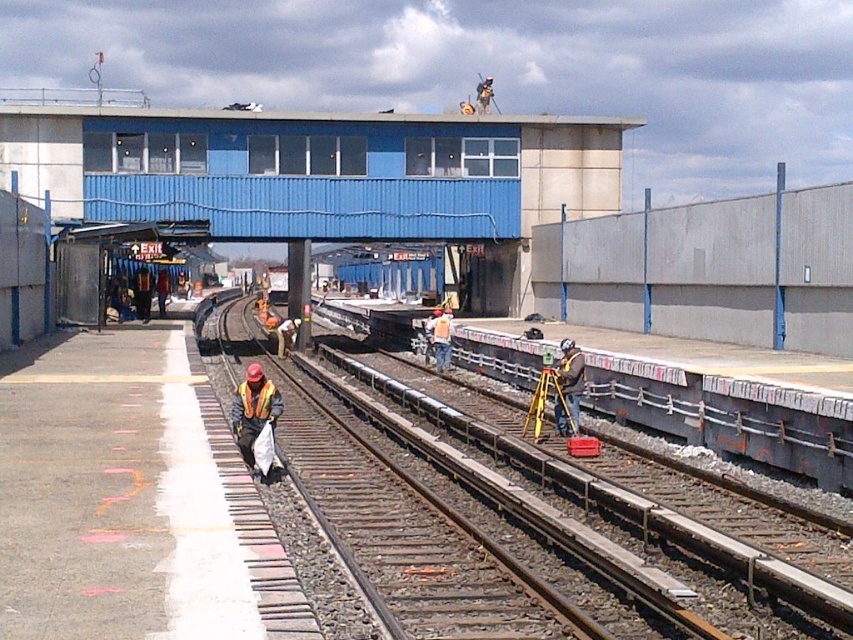
You are standing at the construction site and want to reach the point marked as point (578, 417). The safety regulations state that you must stay at least 60 feet away from any active work zones. Can you safely approach this point without violating the safety rule?

The distance between you and point (578, 417) is 61.67 feet, which is greater than the required 60 feet safety distance. Therefore, you can safely approach this point without violating the safety rule.

You are a safety inspector at the railway construction site. You need to check the visibility of the hard hat at center and the orange reflective safety vest at lower center. Which item is closer to you, the inspector, when you are facing the scene?

The hard hat at center is closer to you because it is further to the viewer than the orange reflective safety vest at lower center, meaning it appears nearer in the scene.

You are a safety inspector checking the construction site. You notice the hard hat at center and the orange reflective safety vest at lower center. Which item is bigger in size?

The hard hat at center is larger in size than the orange reflective safety vest at lower center.